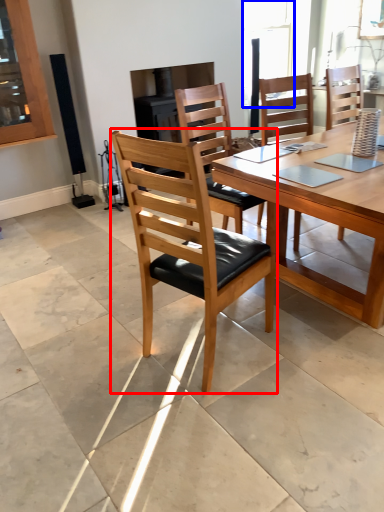
Question: Which of the following is the closest to the observer, chair (highlighted by a red box) or window (highlighted by a blue box)?

Choices:
 (A) chair
 (B) window

Answer: (A)